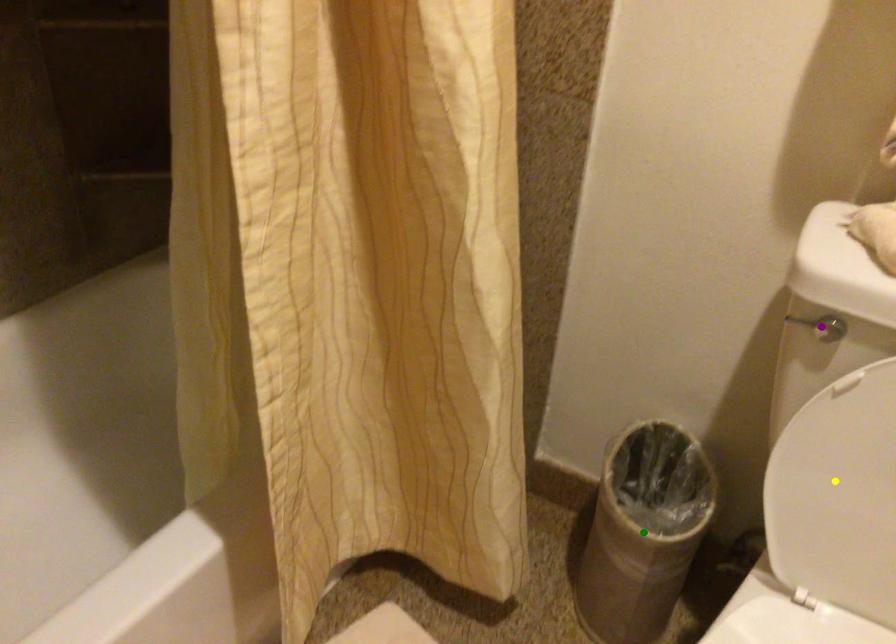
Order these from nearest to farthest:
green point | purple point | yellow point

purple point, yellow point, green point